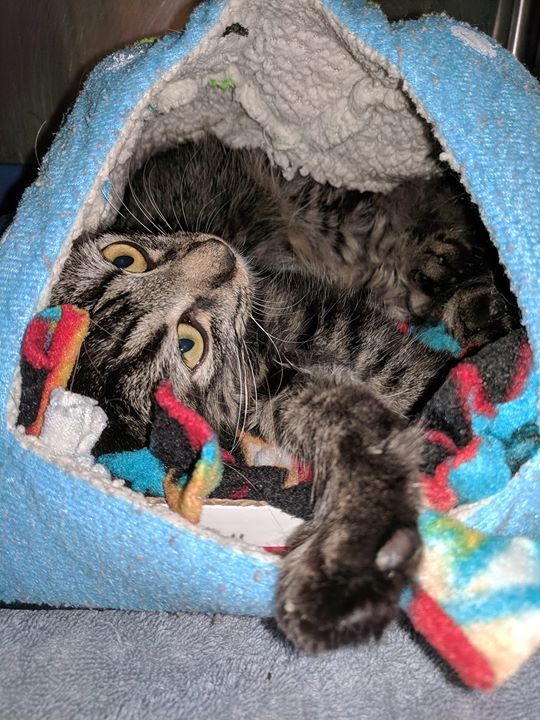
I want to click on towel, so click(x=99, y=680).